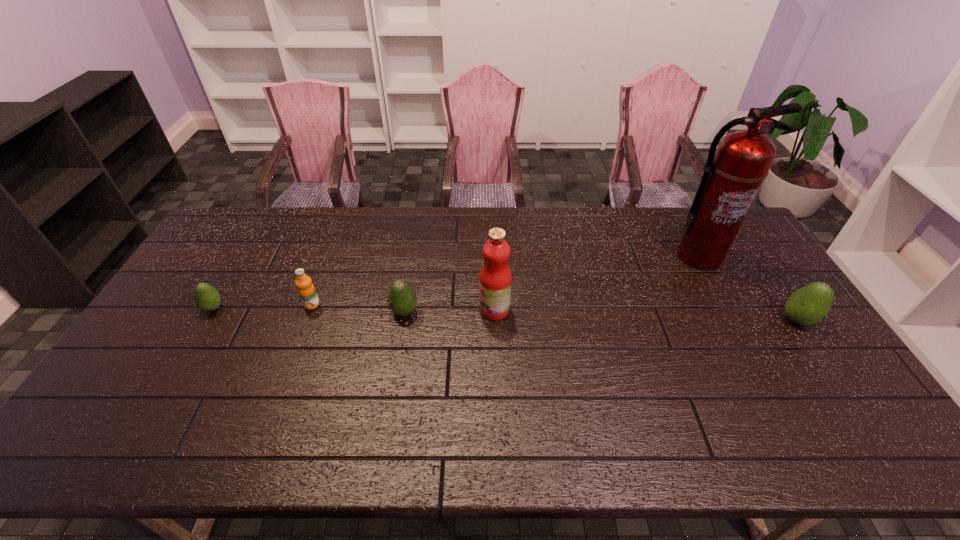
Where is `the shortest object`? the shortest object is located at coordinates (207, 298).

The height and width of the screenshot is (540, 960). I want to click on the shortest avocado, so click(207, 298).

Where is `the fourth object from right to left`? the fourth object from right to left is located at coordinates (402, 299).

Locate an element on the screen. The width and height of the screenshot is (960, 540). the second avocado from right to left is located at coordinates (402, 299).

The image size is (960, 540). Identify the location of the rightmost avocado. (808, 305).

The image size is (960, 540). What are the coordinates of `the tallest avocado` in the screenshot? It's located at (808, 305).

Where is `the second object from right to left`? the second object from right to left is located at coordinates (733, 174).

Where is `the farthest object`? the farthest object is located at coordinates (733, 174).

Find the location of a particular element. the second tallest object is located at coordinates (495, 279).

Identify the location of the fourth object from left to right. The image size is (960, 540). (495, 279).